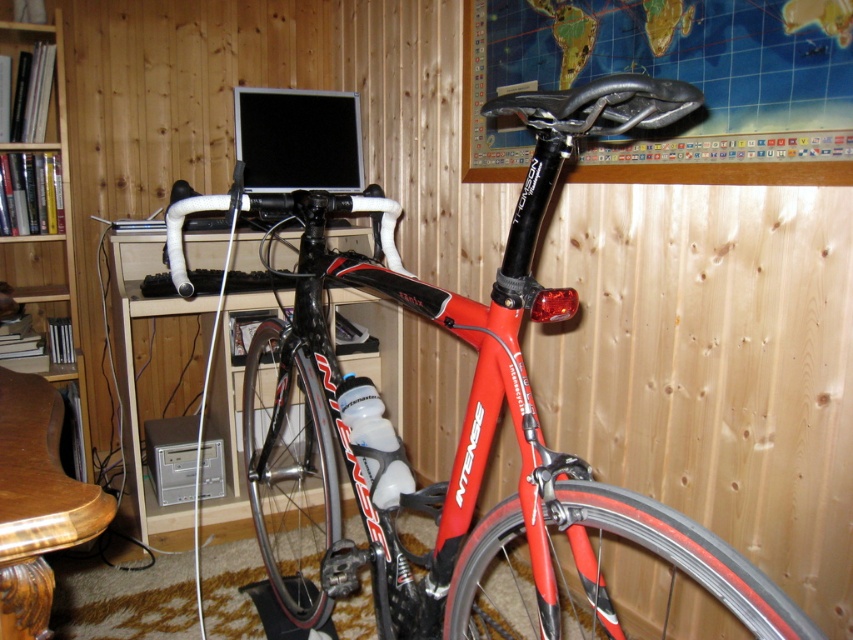
Does wooden polished table at lower left have a greater width compared to wooden bookshelf at left?

Yes, wooden polished table at lower left is wider than wooden bookshelf at left.

Is point (24, 480) farther from camera compared to point (33, 296)?

No.

Identify the location of wooden polished table at lower left. The image size is (853, 640). (36, 502).

Is shiny red bicycle at center to the left of wooden polished table at lower left from the viewer's perspective?

Incorrect, shiny red bicycle at center is not on the left side of wooden polished table at lower left.

Identify the location of shiny red bicycle at center. Image resolution: width=853 pixels, height=640 pixels. (463, 420).

This screenshot has height=640, width=853. Identify the location of shiny red bicycle at center. (463, 420).

Is point (196, 308) positioned before point (9, 266)?

That is True.

Does metallic silver desk at center appear under wooden bookshelf at left?

Indeed, metallic silver desk at center is positioned under wooden bookshelf at left.

Which is behind, point (136, 362) or point (84, 387)?

The point (136, 362) is behind.

Find the location of a particular element. metallic silver desk at center is located at coordinates (148, 376).